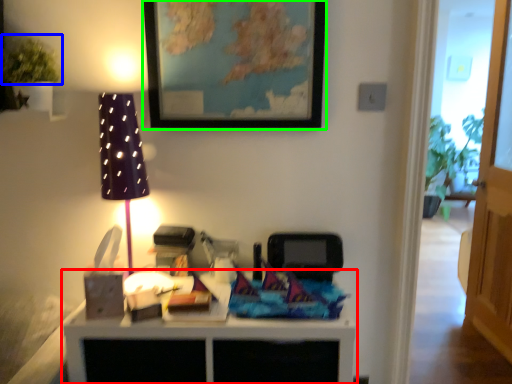
Question: Which object is the farthest from table (highlighted by a red box)? Choose among these: plant (highlighted by a blue box) or picture frame (highlighted by a green box).

Choices:
 (A) plant
 (B) picture frame

Answer: (A)